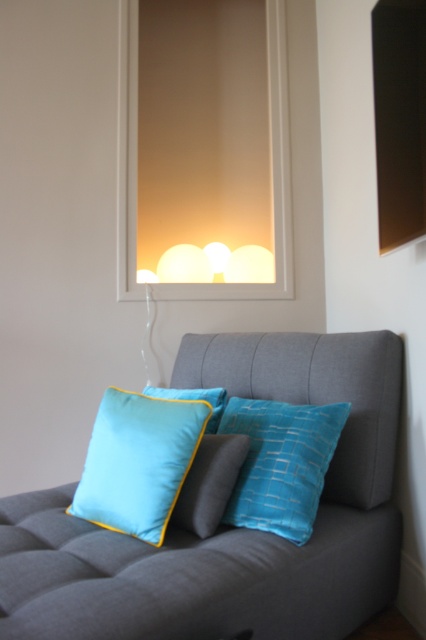
You are arranging a photo shoot in the room and need to position a camera to capture both the turquoise satin pillow at center and the twill blue pillow at center. Which pillow should you focus on first to ensure the camera captures both in the frame?

The turquoise satin pillow at center is in front of the twill blue pillow at center, so you should focus on the turquoise satin pillow at center first to ensure both are in the frame.

You are arranging a photo shoot and need to ensure the teal fabric cushion at center and the twill blue pillow at center are visible in the frame. Based on their positions, which one is closer to the camera?

The twill blue pillow at center is closer to the camera since the teal fabric cushion at center is positioned under it.